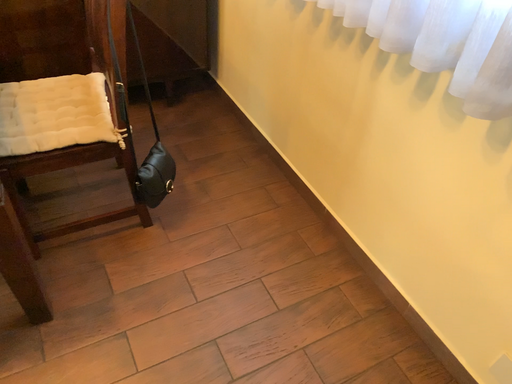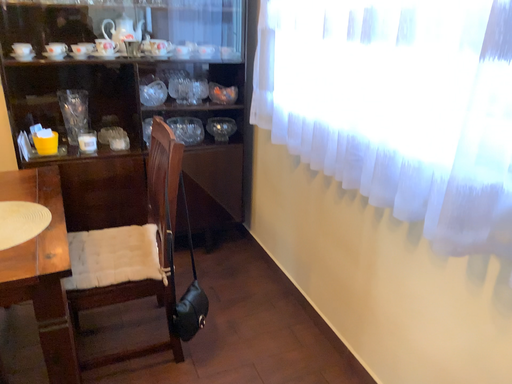
Question: How did the camera likely rotate when shooting the video?

Choices:
 (A) rotated downward
 (B) rotated upward

Answer: (B)